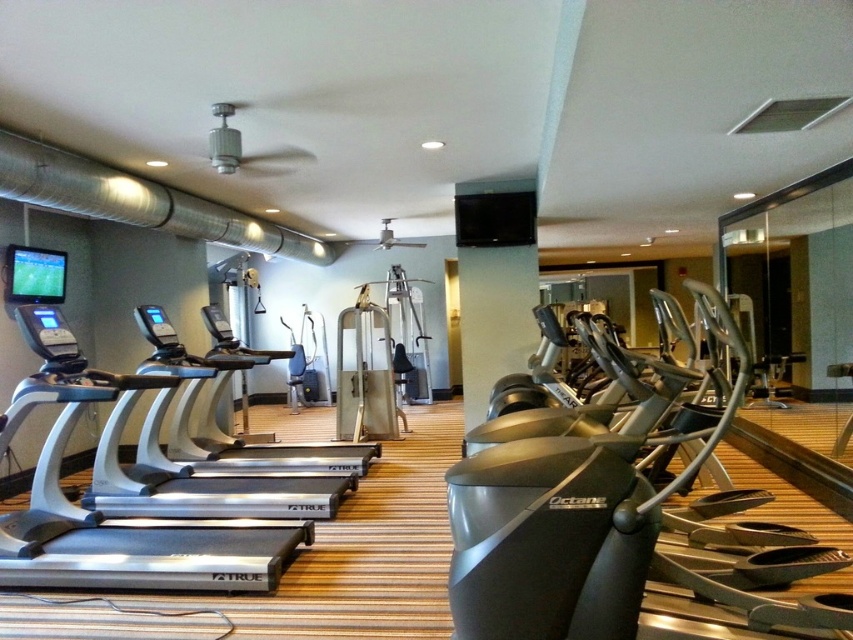
Question: Which is nearer to the black rubberized elliptical at center?

Choices:
 (A) silver metallic treadmill at center
 (B) silver metallic treadmill at left

Answer: (B)

Question: Can you confirm if black rubberized elliptical at center is wider than silver metallic treadmill at center?

Choices:
 (A) yes
 (B) no

Answer: (B)

Question: Estimate the real-world distances between objects in this image. Which object is closer to the silver metallic treadmill at left?

Choices:
 (A) black rubberized elliptical at center
 (B) silver metallic treadmill at center

Answer: (B)

Question: Is black rubberized elliptical at center smaller than silver metallic treadmill at left?

Choices:
 (A) yes
 (B) no

Answer: (B)

Question: Is silver metallic treadmill at left below silver metallic treadmill at center?

Choices:
 (A) yes
 (B) no

Answer: (A)

Question: Which is nearer to the silver metallic treadmill at left?

Choices:
 (A) silver metallic treadmill at center
 (B) black rubberized elliptical at center

Answer: (A)